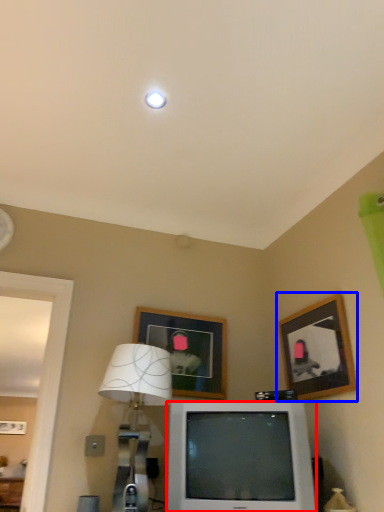
Question: Which point is closer to the camera, television (highlighted by a red box) or picture frame (highlighted by a blue box)?

Choices:
 (A) television
 (B) picture frame

Answer: (A)